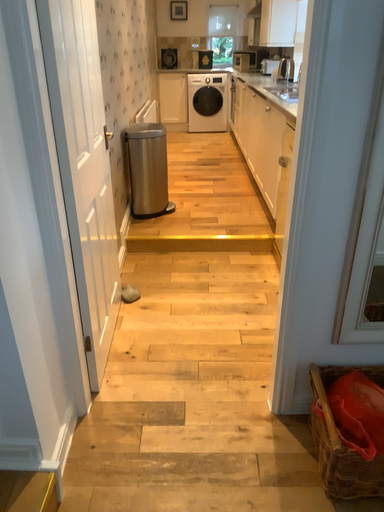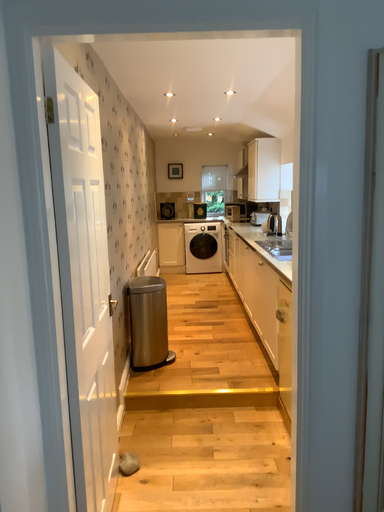
Question: How did the camera likely rotate when shooting the video?

Choices:
 (A) rotated upward
 (B) rotated downward

Answer: (A)